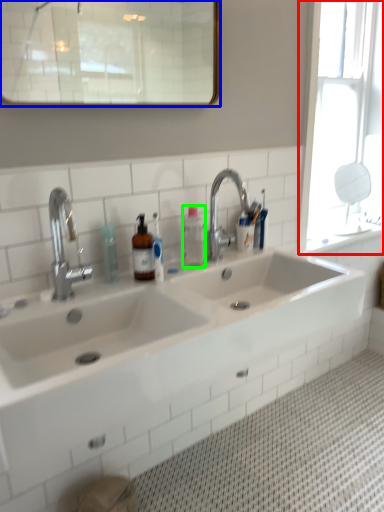
Question: Estimate the real-world distances between objects in this image. Which object is closer to window (highlighted by a red box), mirror (highlighted by a blue box) or bottle (highlighted by a green box)?

Choices:
 (A) mirror
 (B) bottle

Answer: (B)